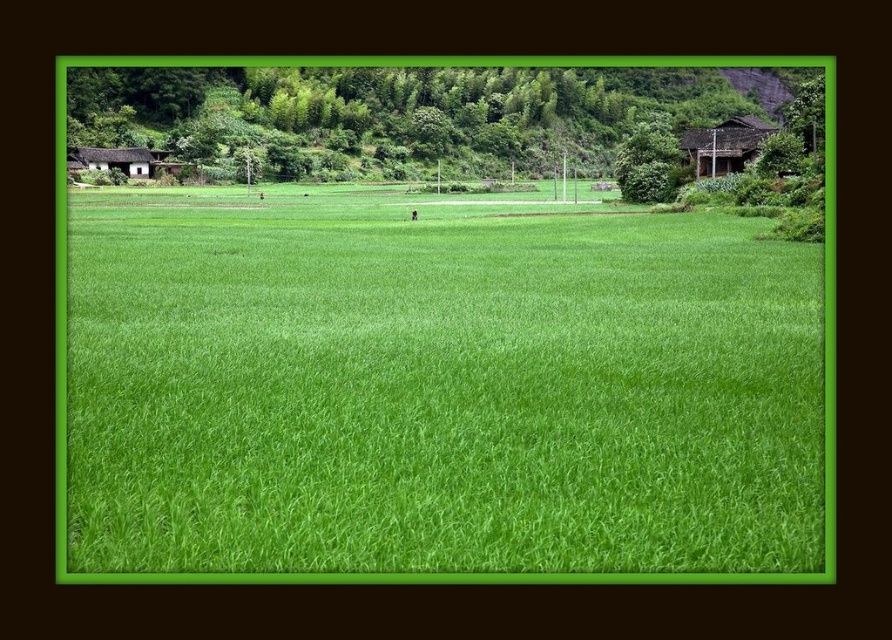
Consider the image. You are a drone operator flying a drone over the rice fields. You need to capture a photo that includes both the green grass at center and the brown wooden hut at left. Which object should you ensure is closer to the camera to include both in the frame?

The green grass at center is larger in size compared to the brown wooden hut at left. To include both in the frame, you should position the drone closer to the smaller brown wooden hut at left so that the larger green grass at center and the smaller hut are balanced in the shot.

You are a farmer checking the growth of your crops. You notice the green grass at center and the brown wooden hut at left in the distance. Which one appears taller from your vantage point?

The green grass at center appears taller than the brown wooden hut at left from your vantage point because the green grass at center has a greater height compared to brown wooden hut at left.